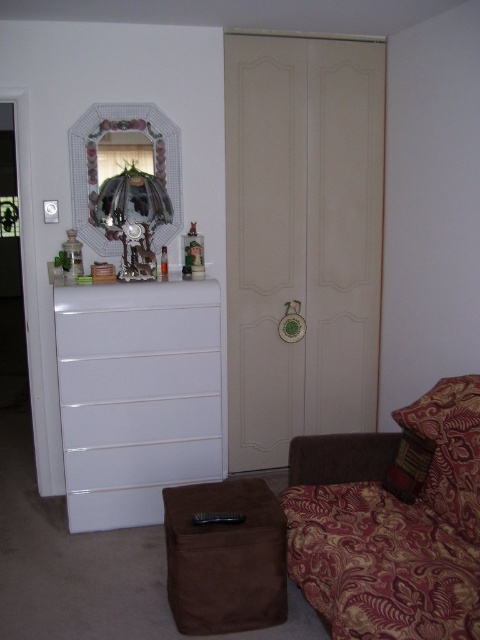
Question: Is patterned fabric couch at lower right to the right of brown suede stool at lower center from the viewer's perspective?

Choices:
 (A) no
 (B) yes

Answer: (B)

Question: Which of the following is the closest to the observer?

Choices:
 (A) (63, 304)
 (B) (395, 484)
 (C) (346, 218)

Answer: (B)

Question: Which point appears farthest from the camera in this image?

Choices:
 (A) (195, 499)
 (B) (80, 138)
 (C) (414, 433)

Answer: (B)

Question: Can you confirm if beige matte door at center is positioned to the right of decorative glass mirror at upper left?

Choices:
 (A) no
 (B) yes

Answer: (B)

Question: Which object appears farthest from the camera in this image?

Choices:
 (A) beige matte door at center
 (B) patterned fabric couch at lower right
 (C) brown suede stool at lower center

Answer: (A)

Question: Is beige matte door at center bigger than white glossy drawer at left?

Choices:
 (A) no
 (B) yes

Answer: (B)